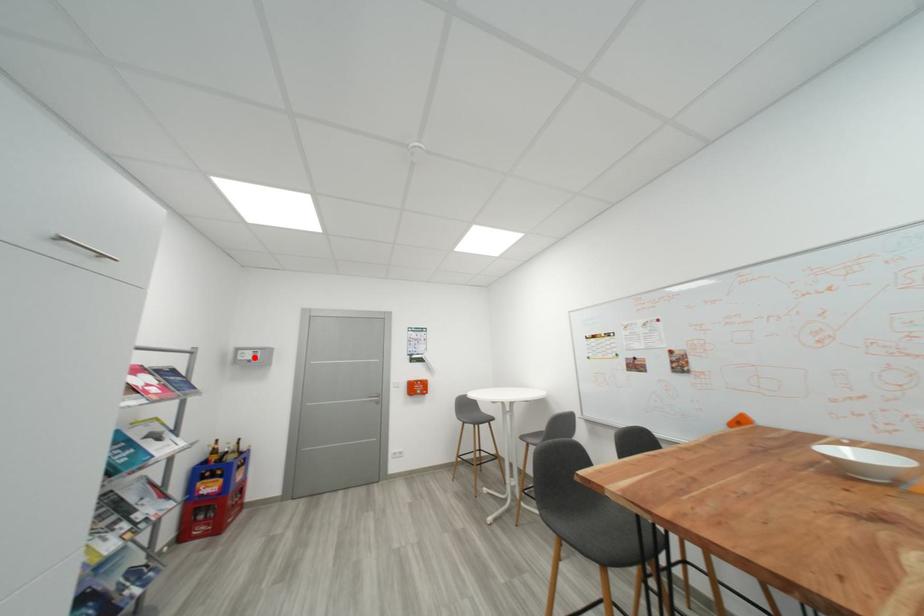
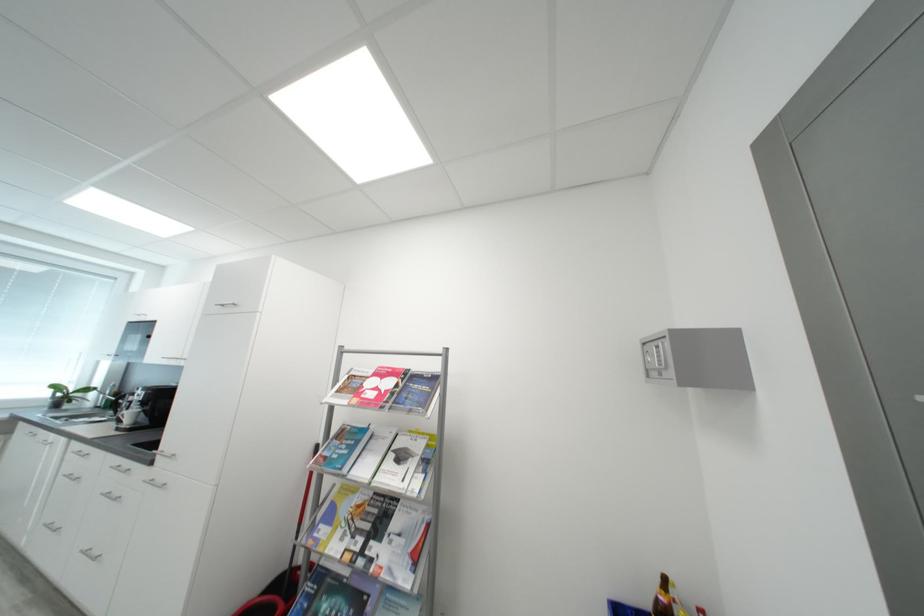
Locate, in the second image, the point that corresponds to the highlighted location in the first image.

(660, 361)